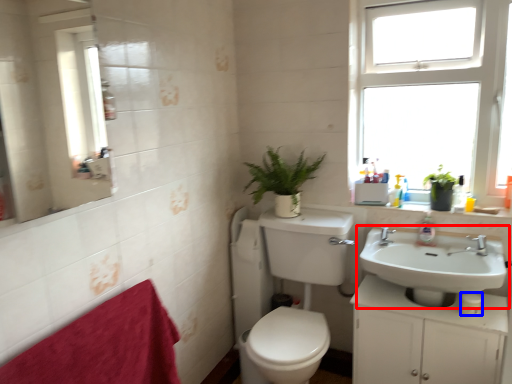
Question: Which object appears farthest to the camera in this image, sink (highlighted by a red box) or toilet paper (highlighted by a blue box)?

Choices:
 (A) sink
 (B) toilet paper

Answer: (B)